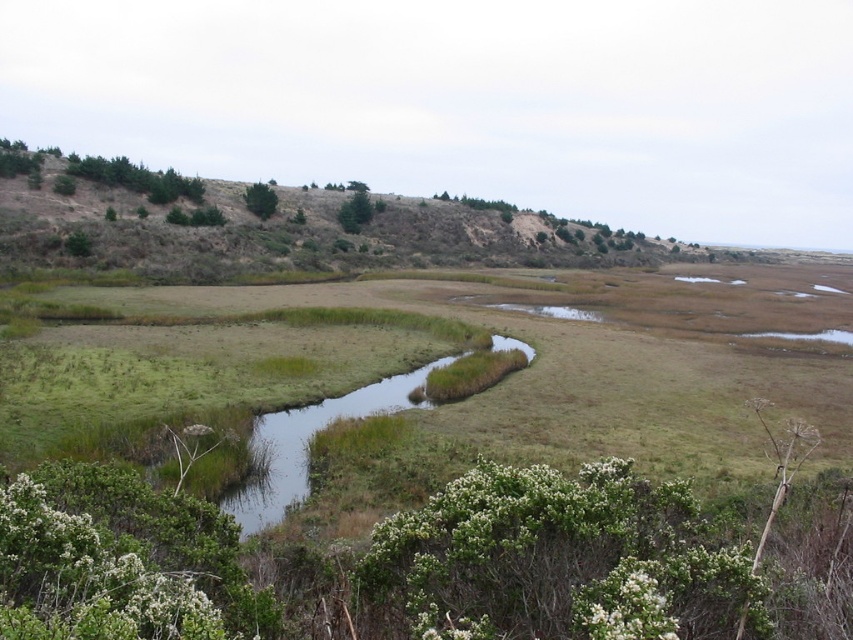
Does brown textured hillside at upper left have a greater height compared to green leafy shrub at upper center?

Yes.

Where is `brown textured hillside at upper left`? brown textured hillside at upper left is located at coordinates (274, 227).

The width and height of the screenshot is (853, 640). What do you see at coordinates (274, 227) in the screenshot? I see `brown textured hillside at upper left` at bounding box center [274, 227].

The width and height of the screenshot is (853, 640). Find the location of `brown textured hillside at upper left`. brown textured hillside at upper left is located at coordinates (274, 227).